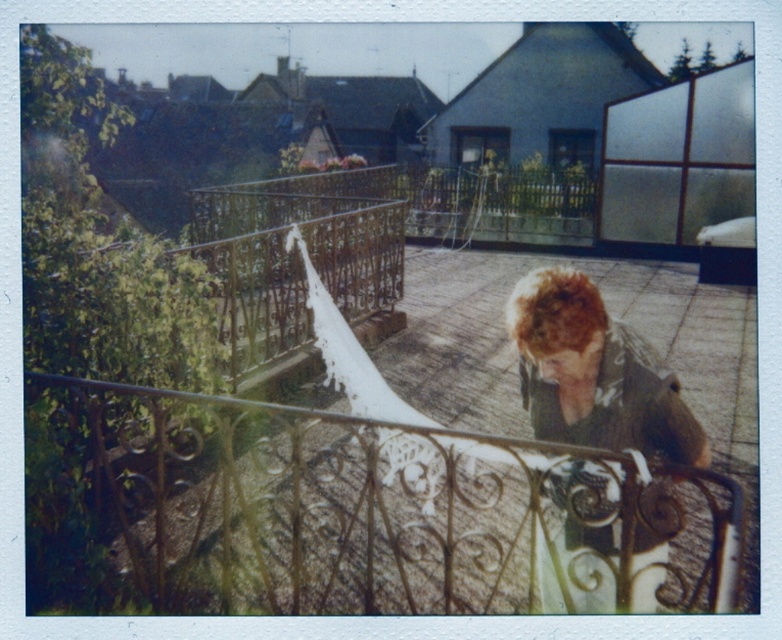
Can you confirm if wrought iron fence at center is positioned to the left of shaggy brown hair at center?

Correct, you'll find wrought iron fence at center to the left of shaggy brown hair at center.

Can you confirm if wrought iron fence at center is positioned above shaggy brown hair at center?

Incorrect, wrought iron fence at center is not positioned above shaggy brown hair at center.

The height and width of the screenshot is (640, 782). What are the coordinates of `wrought iron fence at center` in the screenshot? It's located at (386, 509).

This screenshot has height=640, width=782. I want to click on wrought iron fence at center, so click(x=386, y=509).